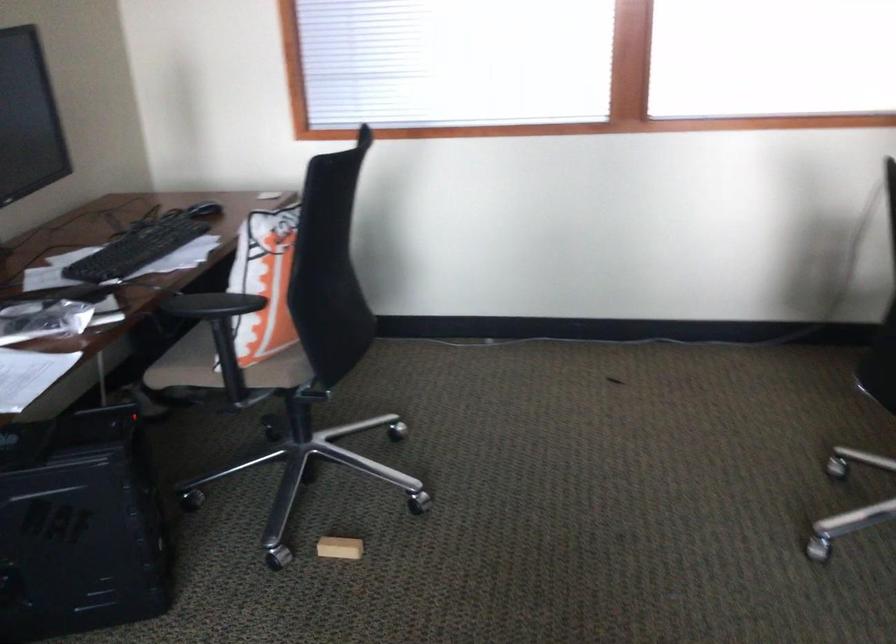
Identify the location of black computer tower. (80, 526).